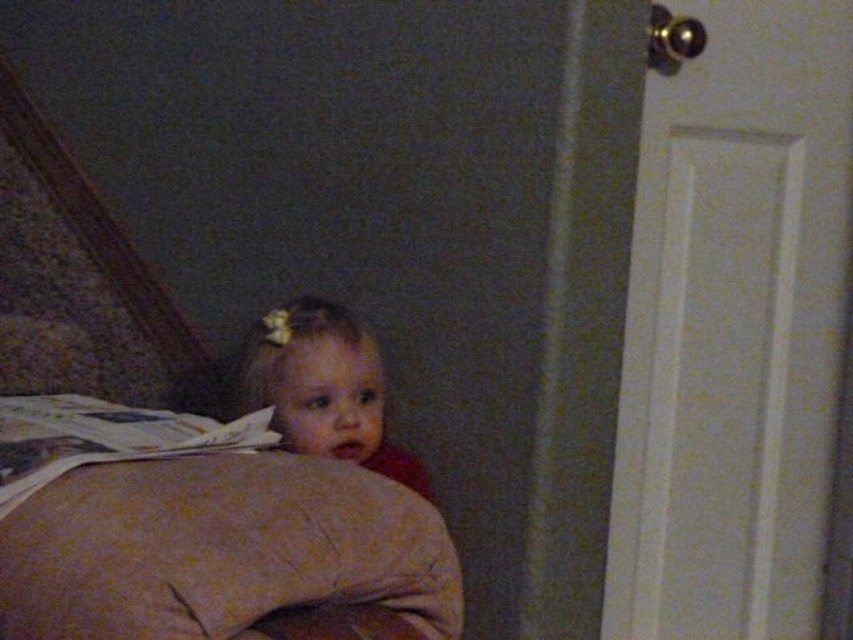
Question: Which point is closer to the camera?

Choices:
 (A) 13,541
 (B) 360,435

Answer: (A)

Question: Which point is closer to the camera?

Choices:
 (A) (281, 458)
 (B) (357, 342)

Answer: (A)

Question: Can you confirm if beige fabric pillow at lower left is positioned to the right of smooth beige pillow at center?

Choices:
 (A) no
 (B) yes

Answer: (A)

Question: Which point is farther to the camera?

Choices:
 (A) beige fabric pillow at lower left
 (B) smooth beige pillow at center

Answer: (B)

Question: Is beige fabric pillow at lower left above smooth beige pillow at center?

Choices:
 (A) no
 (B) yes

Answer: (A)

Question: Is beige fabric pillow at lower left wider than smooth beige pillow at center?

Choices:
 (A) no
 (B) yes

Answer: (B)